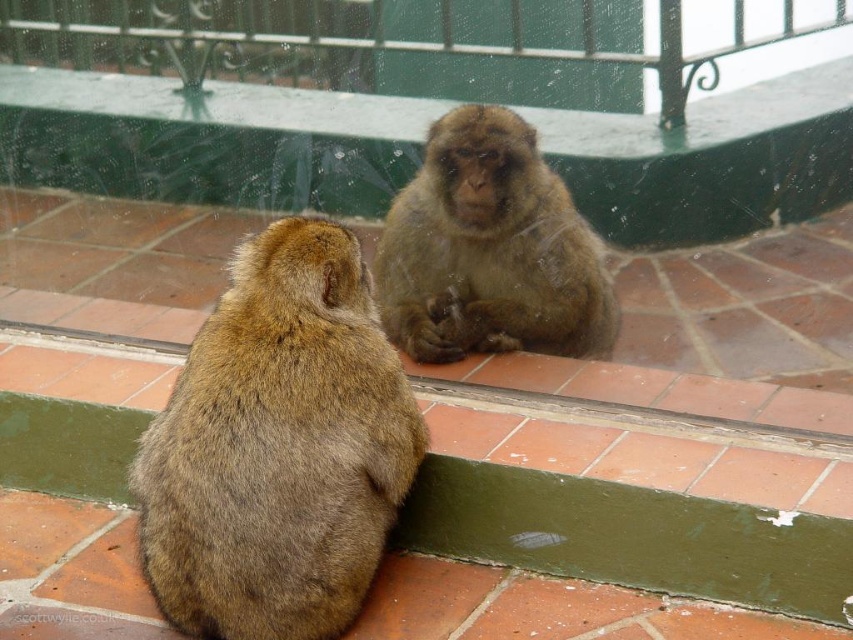
Question: Which object is positioned farthest from the brown furry monkey at lower left?

Choices:
 (A) brown furry monkey at center
 (B) green glass rail at upper center

Answer: (B)

Question: Is brown furry monkey at center positioned behind green glass rail at upper center?

Choices:
 (A) no
 (B) yes

Answer: (B)

Question: Considering the real-world distances, which object is closest to the green glass rail at upper center?

Choices:
 (A) brown furry monkey at center
 (B) brown furry monkey at lower left

Answer: (A)

Question: Which of the following is the closest to the observer?

Choices:
 (A) tap(787, 28)
 (B) tap(480, 106)

Answer: (A)

Question: Can you confirm if brown furry monkey at lower left is smaller than brown furry monkey at center?

Choices:
 (A) no
 (B) yes

Answer: (A)

Question: Can you confirm if brown furry monkey at lower left is smaller than green glass rail at upper center?

Choices:
 (A) no
 (B) yes

Answer: (B)